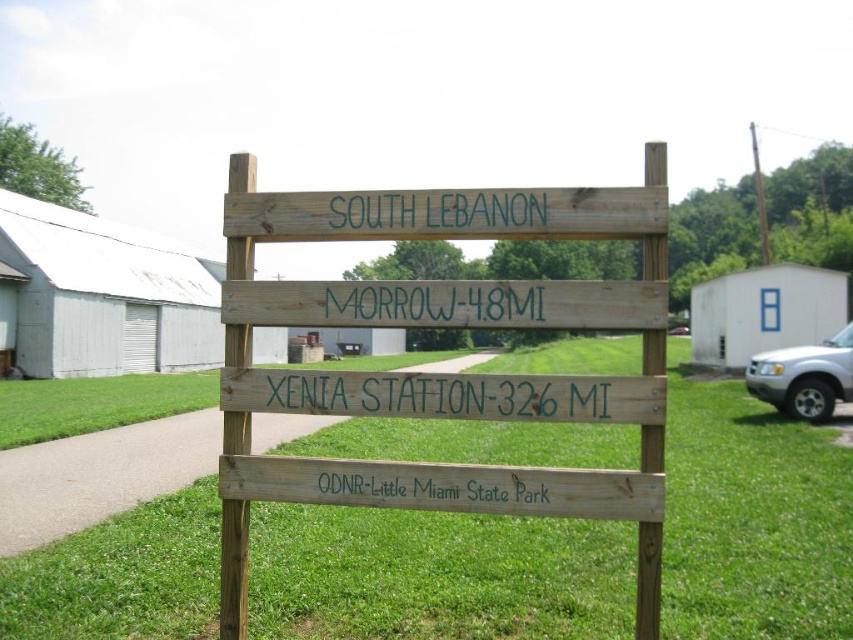
Consider the image. You are standing in front of the wooden signpost in the rural area. You notice the green grass at center and the green wood sign at center. Which object is positioned to the left of the other?

The green grass at center is to the left of the green wood sign at center according to the description.